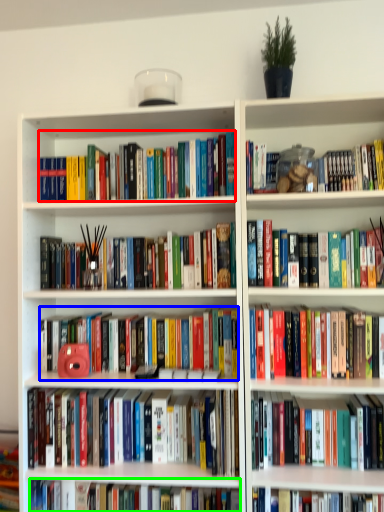
Question: Based on their relative distances, which object is nearer to book (highlighted by a red box)? Choose from book (highlighted by a blue box) and book (highlighted by a green box).

Choices:
 (A) book
 (B) book

Answer: (A)